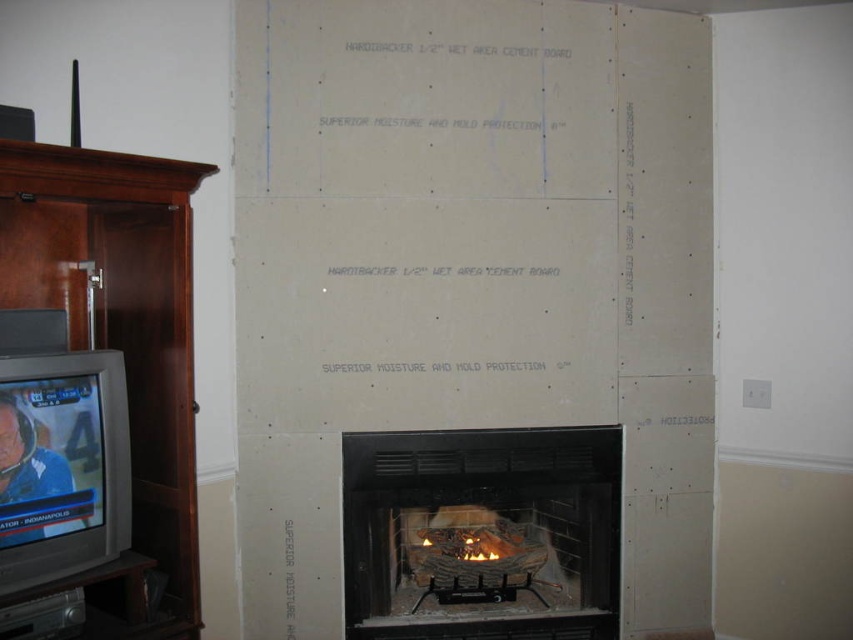
You are standing in the room looking at the fireplace area. There are two points marked on the wall. One is at coordinates point (57, 248) and the other is at point (119, 461). Which point is closer to you?

Point (57, 248) is closer to you because it is further to the viewer than point (119, 461).

You are standing in the room and want to reach the point marked at coordinates (381, 557). If your arm can extend 1.5 meters, can you reach that point without moving closer?

The point at coordinates (381, 557) is 2.91 meters away from the camera. Since your arm can only extend 1.5 meters, you cannot reach it without moving closer.